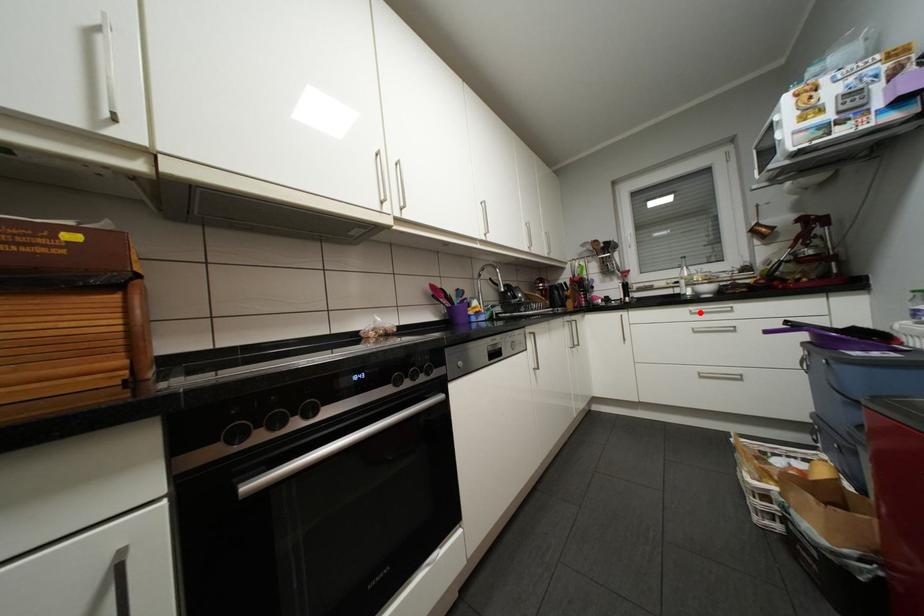
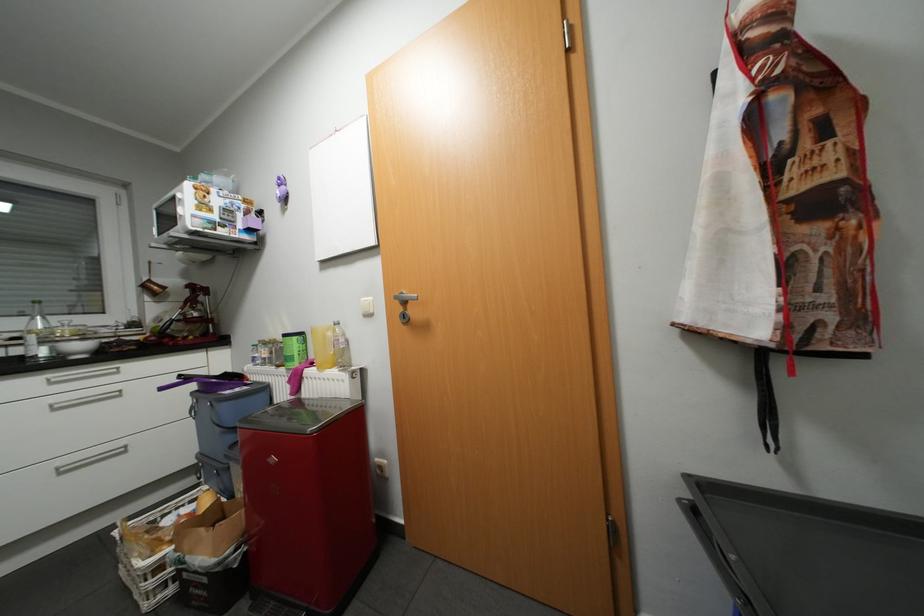
Locate, in the second image, the point that corresponds to the highlighted location in the first image.

(61, 382)